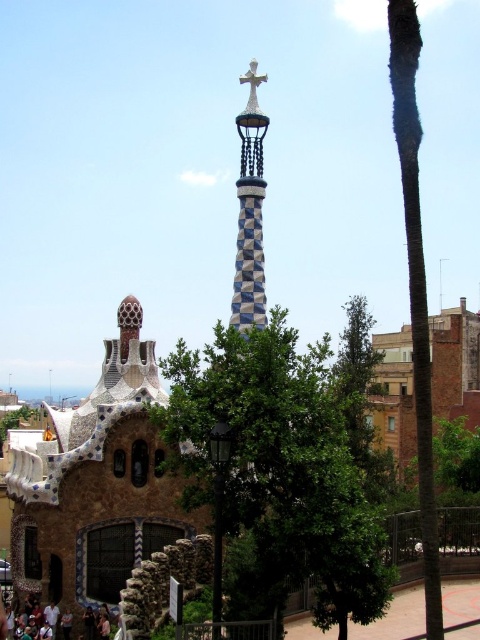
Question: Which of the following is the farthest from the observer?

Choices:
 (A) (264, 74)
 (B) (250, 232)
 (C) (419, 444)

Answer: (A)

Question: Which object is the farthest from the green leafy tree at center?

Choices:
 (A) dark brown leather shoes at lower left
 (B) blue and white mosaic spire at center
 (C) gold metallic cross at upper center

Answer: (C)

Question: Can you confirm if gold metallic cross at upper center is positioned to the right of dark brown leather shoes at lower left?

Choices:
 (A) yes
 (B) no

Answer: (A)

Question: Is gold metallic cross at upper center in front of dark brown leather shoes at lower left?

Choices:
 (A) yes
 (B) no

Answer: (B)

Question: Estimate the real-world distances between objects in this image. Which object is farther from the green leafy palm tree at right?

Choices:
 (A) green leafy tree at center
 (B) blue and white mosaic spire at center

Answer: (B)

Question: Is gold metallic cross at upper center wider than dark brown leather shoes at lower left?

Choices:
 (A) no
 (B) yes

Answer: (A)